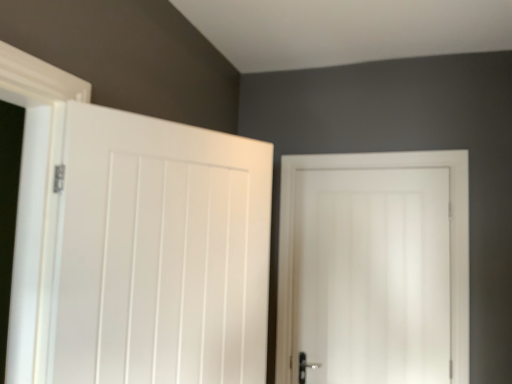
Question: Is white matte door at left, the first door in the front-to-back sequence, situated inside white matte door at center, marked as the second door in a left-to-right arrangement, or outside?

Choices:
 (A) inside
 (B) outside

Answer: (B)

Question: From the image's perspective, is white matte door at left, which is the 1th door from left to right, positioned above or below white matte door at center, the 1th door when ordered from right to left?

Choices:
 (A) below
 (B) above

Answer: (B)

Question: Considering the positions of white matte door at left, the first door in the front-to-back sequence, and white matte door at center, arranged as the 2th door when viewed from the front, in the image, is white matte door at left, the first door in the front-to-back sequence, taller or shorter than white matte door at center, arranged as the 2th door when viewed from the front,?

Choices:
 (A) tall
 (B) short

Answer: (B)

Question: Relative to white matte door at left, the first door in the front-to-back sequence, is white matte door at center, arranged as the 2th door when viewed from the front, in front or behind?

Choices:
 (A) front
 (B) behind

Answer: (B)

Question: From the image's perspective, is white matte door at center, marked as the 1th door in a back-to-front arrangement, located above or below white matte door at left, marked as the second door in a right-to-left arrangement?

Choices:
 (A) below
 (B) above

Answer: (A)

Question: From a real-world perspective, is white matte door at center, the 1th door when ordered from right to left, physically located above or below white matte door at left, the second door in the back-to-front sequence?

Choices:
 (A) below
 (B) above

Answer: (A)

Question: Is white matte door at center, the 1th door when ordered from right to left, inside the boundaries of white matte door at left, which is the 1th door from left to right, or outside?

Choices:
 (A) inside
 (B) outside

Answer: (B)